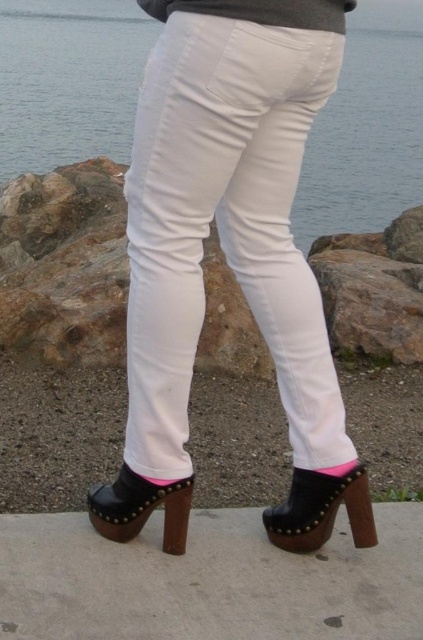
Question: Which point is closer to the camera?

Choices:
 (A) black studded platform shoe at lower center
 (B) black leather clog at lower center

Answer: (B)

Question: Can you confirm if black studded platform shoe at lower center is wider than black leather clog at lower center?

Choices:
 (A) no
 (B) yes

Answer: (A)

Question: Can you confirm if clear blue water at center is wider than black leather clog at lower center?

Choices:
 (A) yes
 (B) no

Answer: (A)

Question: Does clear blue water at center appear on the right side of black leather clog at lower center?

Choices:
 (A) yes
 (B) no

Answer: (B)

Question: Estimate the real-world distances between objects in this image. Which object is closer to the black leather clog at lower center?

Choices:
 (A) white cotton pants at center
 (B) black studded platform shoe at lower center
 (C) clear blue water at center

Answer: (B)

Question: Which is farther from the black leather clog at lower center?

Choices:
 (A) white cotton pants at center
 (B) black studded platform shoe at lower center
 (C) clear blue water at center

Answer: (C)